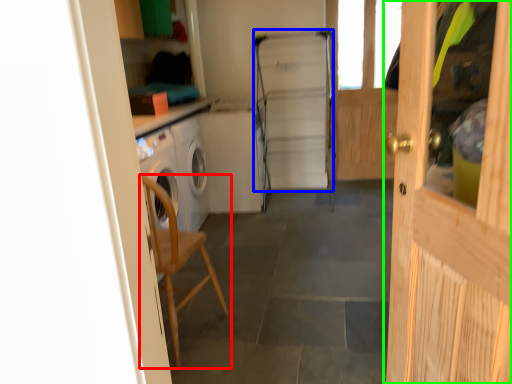
Question: Based on their relative distances, which object is farther from chair (highlighted by a red box)? Choose from fridge (highlighted by a blue box) and door (highlighted by a green box).

Choices:
 (A) fridge
 (B) door

Answer: (A)